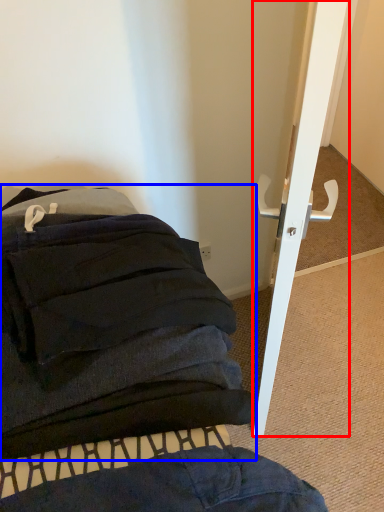
Question: Which of the following is the farthest to the observer, door (highlighted by a red box) or furniture (highlighted by a blue box)?

Choices:
 (A) door
 (B) furniture

Answer: (A)